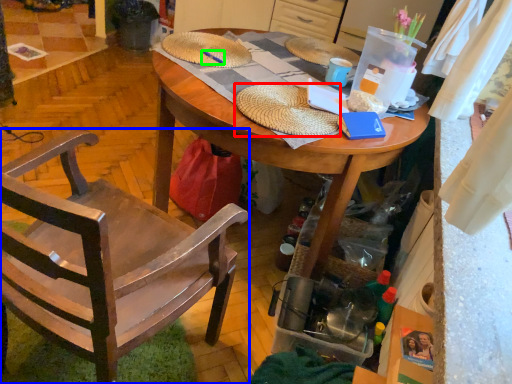
Question: Estimate the real-world distances between objects in this image. Which object is farther from hat (highlighted by a red box), chair (highlighted by a blue box) or pen (highlighted by a green box)?

Choices:
 (A) chair
 (B) pen

Answer: (A)